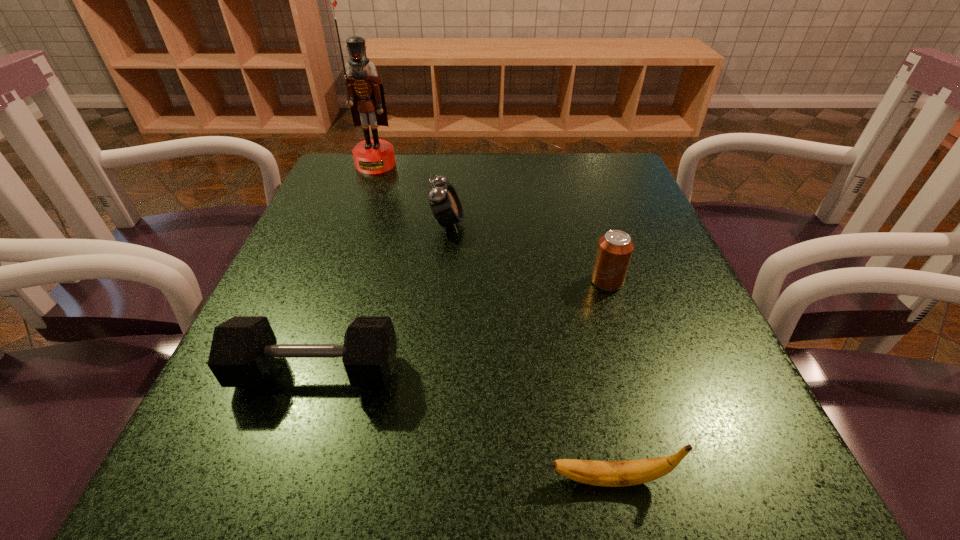
Image resolution: width=960 pixels, height=540 pixels. Identify the location of banana that is at the right edge. (633, 472).

You are a GUI agent. You are given a task and a screenshot of the screen. Output one action in this format:
    pyautogui.click(x=<x>, y=<y>)
    Task: Click on the object situated at the far left corner
    
    Given the screenshot: What is the action you would take?
    pyautogui.click(x=365, y=95)

You are a GUI agent. You are given a task and a screenshot of the screen. Output one action in this format:
    pyautogui.click(x=<x>, y=<y>)
    Task: Click on the object that is at the near right corner
    
    Given the screenshot: What is the action you would take?
    pyautogui.click(x=633, y=472)

In order to click on free space at the far edge in this screenshot , I will do `click(420, 198)`.

The height and width of the screenshot is (540, 960). What are the coordinates of `vacant space at the near edge` in the screenshot? It's located at (444, 475).

You are a GUI agent. You are given a task and a screenshot of the screen. Output one action in this format:
    pyautogui.click(x=<x>, y=<y>)
    Task: Click on the free space at the left edge of the desktop
    This screenshot has width=960, height=540.
    Given the screenshot: What is the action you would take?
    pyautogui.click(x=263, y=420)

Locate an element on the screen. free space at the right edge of the desktop is located at coordinates (663, 262).

Identify the location of vacant space at the near left corner. (246, 482).

Identify the location of free space at the far right corner of the desktop. (568, 173).

Identify the location of free space that is in between the banana and the dumbbell. The height and width of the screenshot is (540, 960). (463, 426).